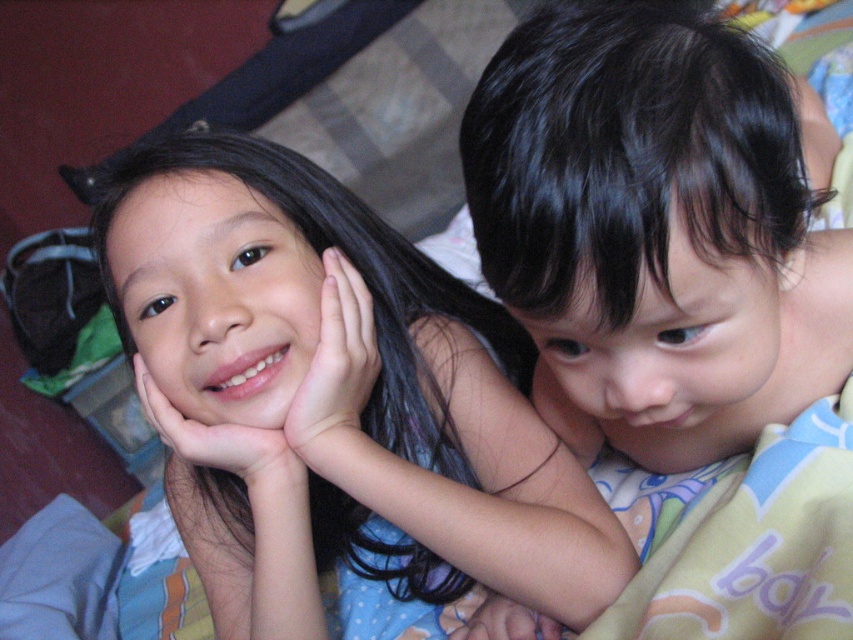
Question: Can you confirm if smooth skin hand at center is positioned to the left of smooth skin hand at lower center?

Choices:
 (A) yes
 (B) no

Answer: (A)

Question: Among these objects, which one is nearest to the camera?

Choices:
 (A) smooth skin girl at center
 (B) pink flesh-toned hand at center
 (C) smooth skin hand at lower right
 (D) smooth skin hand at center

Answer: (A)

Question: Is pink flesh-toned hand at center wider than smooth skin hand at center?

Choices:
 (A) no
 (B) yes

Answer: (A)

Question: Among these points, which one is nearest to the camera?

Choices:
 (A) (701, 184)
 (B) (201, 460)
 (C) (547, 388)
 (D) (347, 406)

Answer: (A)

Question: Which point is closer to the camera?

Choices:
 (A) (538, 307)
 (B) (520, 556)
 (C) (345, 438)
 (D) (560, 634)

Answer: (A)

Question: Does smooth skin girl at center have a larger size compared to pink flesh-toned hand at center?

Choices:
 (A) yes
 (B) no

Answer: (A)